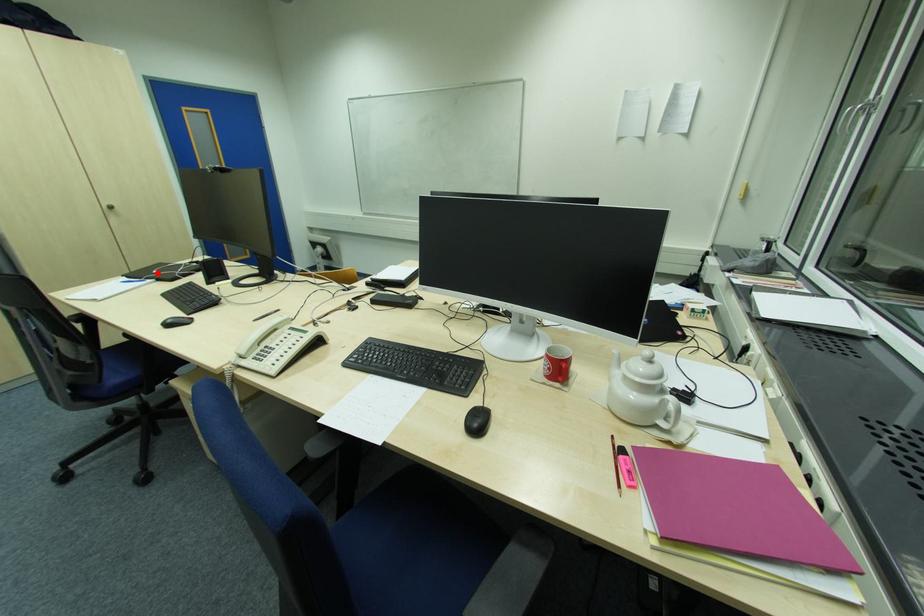
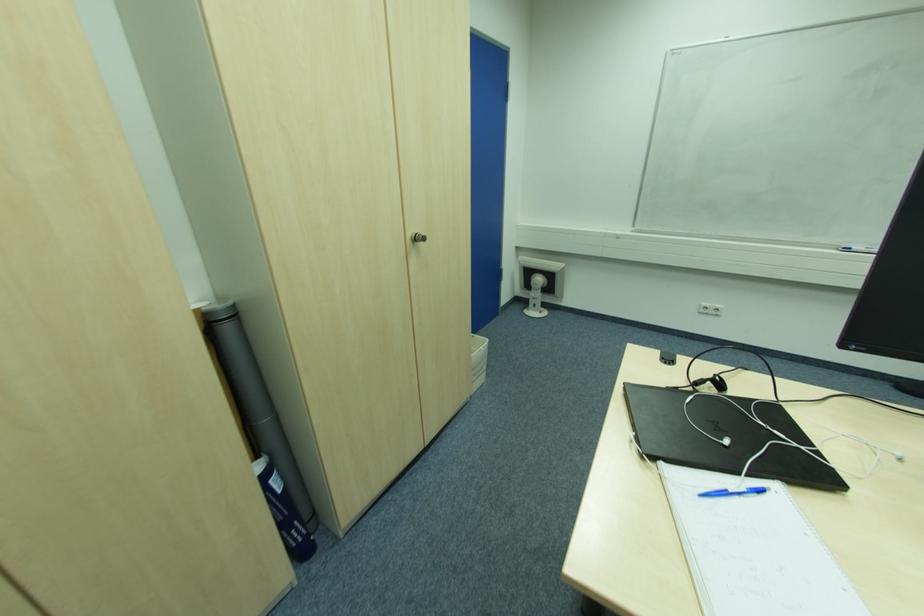
The point at the highlighted location is marked in the first image. Where is the corresponding point in the second image?

(728, 443)